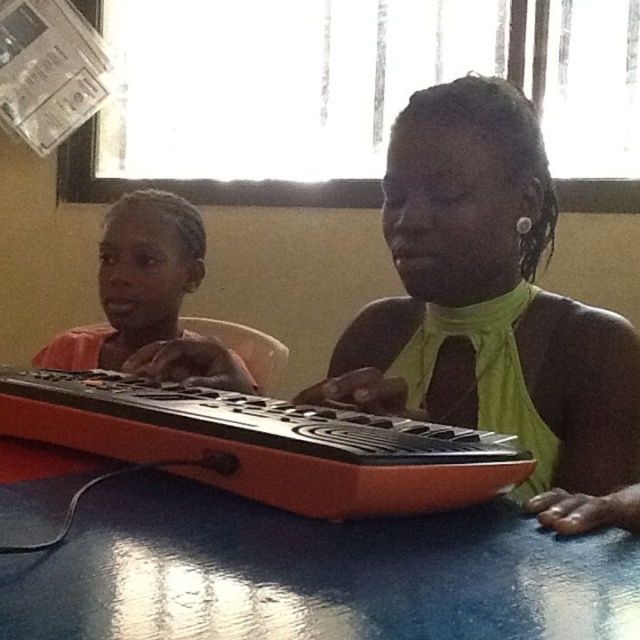
You are standing in front of the blue glossy table at lower center and want to reach the orange matte keyboard at left. Which direction should you move to get closer to the keyboard?

The blue glossy table at lower center is to the right of the orange matte keyboard at left, so you should move to your left to get closer to the keyboard.

You are standing in front of the keyboard instrument and see two points marked on the table. The first point is at position point [577,356] and the second is at point [109,324]. Which point is closer to you?

Point [577,356] is in front of point [109,324], so the first point is closer to you.

In the scene shown: You are standing 15 inches away from the table where the keyboard is placed. Is the point at coordinate point (282,573) closer to you than the keyboard?

The distance of point (282,573) from viewer is 16.14 inches. Since you are standing 15 inches away from the table, the point is farther away than the table itself, so it is not closer to you than the keyboard.